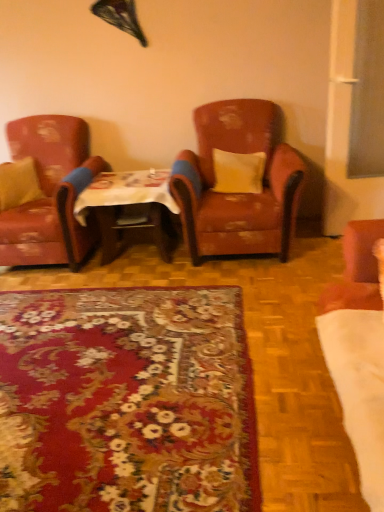
What do you see at coordinates (19, 183) in the screenshot? The image size is (384, 512). I see `matte yellow pillow at left, the 2th pillow in the right-to-left sequence` at bounding box center [19, 183].

The height and width of the screenshot is (512, 384). Identify the location of leather armchair at left, the second chair when ordered from right to left. (47, 192).

Image resolution: width=384 pixels, height=512 pixels. What do you see at coordinates (126, 401) in the screenshot?
I see `floral carpet at center` at bounding box center [126, 401].

I want to click on matte yellow pillow at left, the 2th pillow in the right-to-left sequence, so click(x=19, y=183).

Is floral carpet at center to the left or to the right of yellow fabric pillow at center, which is the first pillow in right-to-left order, in the image?

floral carpet at center is positioned on yellow fabric pillow at center, which is the first pillow in right-to-left order,'s left side.

Do you think floral carpet at center is within yellow fabric pillow at center, which is counted as the 2th pillow, starting from the left, or outside of it?

floral carpet at center is not enclosed by yellow fabric pillow at center, which is counted as the 2th pillow, starting from the left.

Does floral carpet at center come in front of yellow fabric pillow at center, which is counted as the 2th pillow, starting from the left?

Yes, floral carpet at center is closer to the camera.

Which of these two, floral carpet at center or yellow fabric pillow at center, which is counted as the 2th pillow, starting from the left, stands shorter?

floral carpet at center is shorter.

How many degrees apart are the facing directions of floral carpet at center and leather-like brown armchair at center, the second chair positioned from the left?

There is a 88.8-degree angle between the facing directions of floral carpet at center and leather-like brown armchair at center, the second chair positioned from the left.

Visually, is floral carpet at center positioned to the left or to the right of leather-like brown armchair at center, the second chair positioned from the left?

floral carpet at center is positioned on leather-like brown armchair at center, the second chair positioned from the left,'s left side.

I want to click on the 2nd chair positioned above the floral carpet at center (from the image's perspective), so click(238, 194).

Can you confirm if floral carpet at center is smaller than leather-like brown armchair at center, the second chair positioned from the left?

Yes.

Is wooden table at center facing away from floral carpet at center?

That's not correct — wooden table at center is not looking away from floral carpet at center.

Considering the sizes of wooden table at center and floral carpet at center in the image, is wooden table at center bigger or smaller than floral carpet at center?

Clearly, wooden table at center is larger in size than floral carpet at center.

Would you say floral carpet at center is part of wooden table at center's contents?

No, floral carpet at center is not a part of wooden table at center.

Considering the relative positions of matte yellow pillow at left, positioned as the first pillow in left-to-right order, and wooden table at center in the image provided, is matte yellow pillow at left, positioned as the first pillow in left-to-right order, to the left or to the right of wooden table at center?

Based on their positions, matte yellow pillow at left, positioned as the first pillow in left-to-right order, is located to the left of wooden table at center.

Who is shorter, matte yellow pillow at left, positioned as the first pillow in left-to-right order, or wooden table at center?

Standing shorter between the two is matte yellow pillow at left, positioned as the first pillow in left-to-right order.

Is matte yellow pillow at left, the 2th pillow in the right-to-left sequence, smaller than wooden table at center?

Yes.

Considering the relative sizes of matte yellow pillow at left, the 2th pillow in the right-to-left sequence, and wooden table at center in the image provided, is matte yellow pillow at left, the 2th pillow in the right-to-left sequence, wider than wooden table at center?

No, matte yellow pillow at left, the 2th pillow in the right-to-left sequence, is not wider than wooden table at center.

From the image's perspective, does matte yellow pillow at left, the 2th pillow in the right-to-left sequence, appear higher than leather-like brown armchair at center, which appears as the 1th chair when viewed from the right?

No, from the image's perspective, matte yellow pillow at left, the 2th pillow in the right-to-left sequence, is not over leather-like brown armchair at center, which appears as the 1th chair when viewed from the right.

Between matte yellow pillow at left, the 2th pillow in the right-to-left sequence, and leather-like brown armchair at center, which appears as the 1th chair when viewed from the right, which one has more height?

With more height is leather-like brown armchair at center, which appears as the 1th chair when viewed from the right.

Which is more distant, (8, 195) or (239, 230)?

The point (8, 195) is farther from the camera.

Which of these two, leather-like brown armchair at center, which appears as the 1th chair when viewed from the right, or leather armchair at left, marked as the first chair in a left-to-right arrangement, stands shorter?

leather armchair at left, marked as the first chair in a left-to-right arrangement, is shorter.

How far apart are leather-like brown armchair at center, the second chair positioned from the left, and leather armchair at left, marked as the first chair in a left-to-right arrangement?

The distance of leather-like brown armchair at center, the second chair positioned from the left, from leather armchair at left, marked as the first chair in a left-to-right arrangement, is 3.45 feet.

Could leather armchair at left, the second chair when ordered from right to left, be considered to be inside leather-like brown armchair at center, the second chair positioned from the left?

Definitely not — leather armchair at left, the second chair when ordered from right to left, is not inside leather-like brown armchair at center, the second chair positioned from the left.

Considering the sizes of objects leather-like brown armchair at center, the second chair positioned from the left, and floral carpet at center in the image provided, who is smaller, leather-like brown armchair at center, the second chair positioned from the left, or floral carpet at center?

Smaller between the two is floral carpet at center.

Is leather-like brown armchair at center, which appears as the 1th chair when viewed from the right, not close to floral carpet at center?

leather-like brown armchair at center, which appears as the 1th chair when viewed from the right, is far away from floral carpet at center.

Identify the location of chair that is the 2nd object located above the floral carpet at center (from the image's perspective). This screenshot has width=384, height=512. (238, 194).

In the image, there is a yellow fabric pillow at center, which is counted as the 2th pillow, starting from the left. Identify the location of mat below it (from the image's perspective). The height and width of the screenshot is (512, 384). (126, 401).

From a real-world perspective, starting from the floral carpet at center, which chair is the 2nd one vertically above it? Please provide its 2D coordinates.

[(238, 194)]

Based on the photo, based on their spatial positions, is yellow fabric pillow at center, which is the first pillow in right-to-left order, or wooden table at center further from matte yellow pillow at left, the 2th pillow in the right-to-left sequence?

yellow fabric pillow at center, which is the first pillow in right-to-left order.

From the image, which object appears to be farther from leather armchair at left, the second chair when ordered from right to left, matte yellow pillow at left, the 2th pillow in the right-to-left sequence, or wooden table at center?

wooden table at center lies further to leather armchair at left, the second chair when ordered from right to left, than the other object.

Based on their spatial positions, is floral carpet at center or leather armchair at left, marked as the first chair in a left-to-right arrangement, closer to yellow fabric pillow at center, which is counted as the 2th pillow, starting from the left?

Among the two, leather armchair at left, marked as the first chair in a left-to-right arrangement, is located nearer to yellow fabric pillow at center, which is counted as the 2th pillow, starting from the left.

Looking at the image, which one is located closer to leather armchair at left, marked as the first chair in a left-to-right arrangement, leather-like brown armchair at center, the second chair positioned from the left, or matte yellow pillow at left, the 2th pillow in the right-to-left sequence?

matte yellow pillow at left, the 2th pillow in the right-to-left sequence.

Estimate the real-world distances between objects in this image. Which object is closer to matte yellow pillow at left, positioned as the first pillow in left-to-right order, yellow fabric pillow at center, which is the first pillow in right-to-left order, or leather armchair at left, the second chair when ordered from right to left?

The object closer to matte yellow pillow at left, positioned as the first pillow in left-to-right order, is leather armchair at left, the second chair when ordered from right to left.

From the picture: Estimate the real-world distances between objects in this image. Which object is closer to leather armchair at left, marked as the first chair in a left-to-right arrangement, yellow fabric pillow at center, which is the first pillow in right-to-left order, or floral carpet at center?

Among the two, yellow fabric pillow at center, which is the first pillow in right-to-left order, is located nearer to leather armchair at left, marked as the first chair in a left-to-right arrangement.

Based on their spatial positions, is yellow fabric pillow at center, which is the first pillow in right-to-left order, or floral carpet at center closer to leather-like brown armchair at center, the second chair positioned from the left?

yellow fabric pillow at center, which is the first pillow in right-to-left order.

Which object lies further to the anchor point matte yellow pillow at left, positioned as the first pillow in left-to-right order, floral carpet at center or yellow fabric pillow at center, which is the first pillow in right-to-left order?

floral carpet at center.

Find the location of `table located between leather armchair at left, the second chair when ordered from right to left, and yellow fabric pillow at center, which is counted as the 2th pillow, starting from the left, in the left-right direction`. table located between leather armchair at left, the second chair when ordered from right to left, and yellow fabric pillow at center, which is counted as the 2th pillow, starting from the left, in the left-right direction is located at coordinates (130, 210).

The width and height of the screenshot is (384, 512). I want to click on mat situated between leather armchair at left, marked as the first chair in a left-to-right arrangement, and leather-like brown armchair at center, the second chair positioned from the left, from left to right, so click(x=126, y=401).

You are a GUI agent. You are given a task and a screenshot of the screen. Output one action in this format:
    pyautogui.click(x=<x>, y=<y>)
    Task: Click on the table between matte yellow pillow at left, the 2th pillow in the right-to-left sequence, and yellow fabric pillow at center, which is counted as the 2th pillow, starting from the left
    
    Given the screenshot: What is the action you would take?
    pyautogui.click(x=130, y=210)

Identify the location of chair between matte yellow pillow at left, the 2th pillow in the right-to-left sequence, and leather-like brown armchair at center, which appears as the 1th chair when viewed from the right. (47, 192).